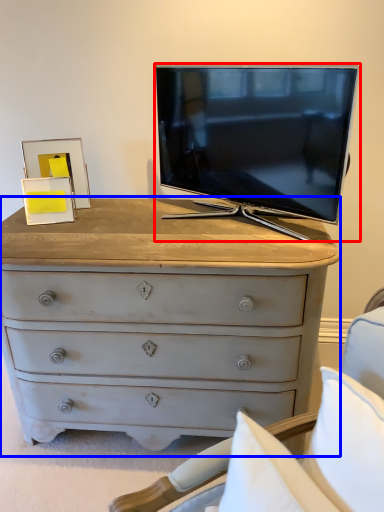
Question: Which object is closer to the camera taking this photo, television (highlighted by a red box) or chest of drawers (highlighted by a blue box)?

Choices:
 (A) television
 (B) chest of drawers

Answer: (B)